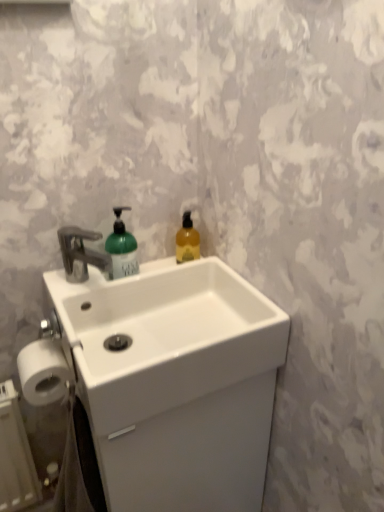
At what (x,y) coordinates should I click in order to perform the action: click on free spot in front of translucent amber liquid at upper right, acting as the 2th bottle starting from the left. Please return your answer as a coordinate pair (x, y). The width and height of the screenshot is (384, 512). Looking at the image, I should click on (194, 279).